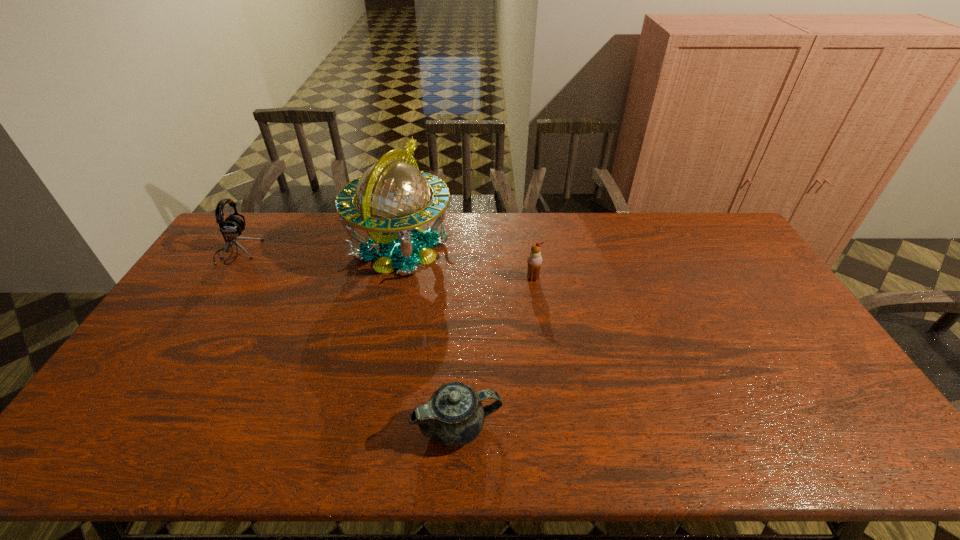
At what (x,y) coordinates should I click in order to perform the action: click on the tallest object. Please return your answer as a coordinate pair (x, y). The height and width of the screenshot is (540, 960). Looking at the image, I should click on (393, 197).

Locate an element on the screen. Image resolution: width=960 pixels, height=540 pixels. the third shortest object is located at coordinates (232, 227).

The height and width of the screenshot is (540, 960). I want to click on the leftmost object, so click(232, 227).

Locate an element on the screen. the rightmost object is located at coordinates (534, 260).

Where is `the nearest object`? This screenshot has width=960, height=540. the nearest object is located at coordinates (454, 416).

This screenshot has width=960, height=540. In order to click on free space located 0.260m on the left of the globe in this screenshot , I will do (274, 249).

Identify the location of vacant space positioned 0.290m on the right of the earphone. The height and width of the screenshot is (540, 960). (340, 252).

At what (x,y) coordinates should I click in order to perform the action: click on vacant space located 0.190m at the front with a straw on the icecream. Please return your answer as a coordinate pair (x, y). This screenshot has width=960, height=540. Looking at the image, I should click on (540, 326).

The width and height of the screenshot is (960, 540). I want to click on free region located 0.060m from the spout of the chinaware, so click(x=527, y=427).

Locate an element on the screen. This screenshot has width=960, height=540. globe that is at the far edge is located at coordinates (393, 197).